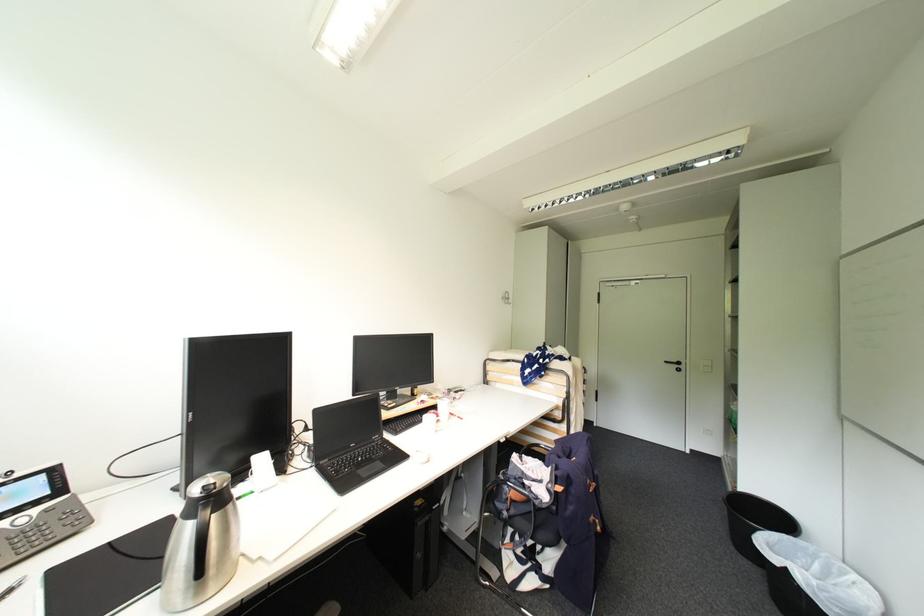
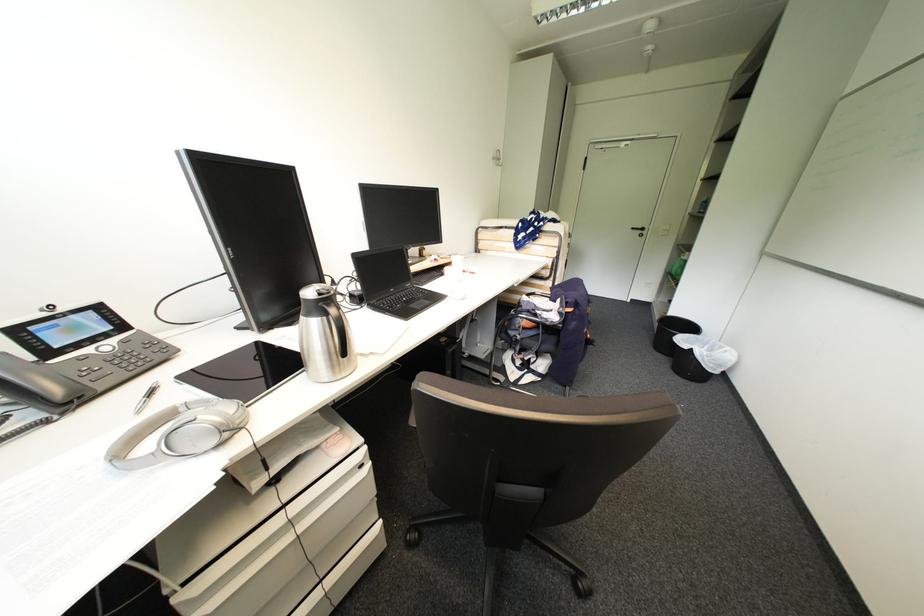
Question: What movement of the cameraman would produce the second image?

Choices:
 (A) Left
 (B) Right
 (C) Forward
 (D) Backward

Answer: (A)